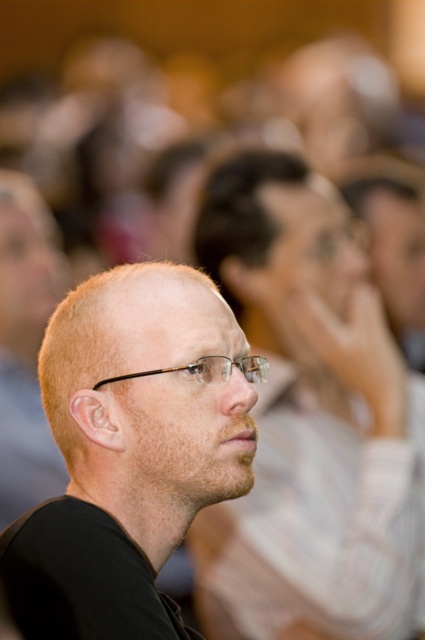
The image size is (425, 640). What are the coordinates of `matte black glasses at center` in the screenshot? It's located at (311, 422).

Describe the element at coordinates (311, 422) in the screenshot. The height and width of the screenshot is (640, 425). I see `matte black glasses at center` at that location.

Which is behind, point (379, 554) or point (62, 563)?

The point (379, 554) is more distant.

At what (x,y) coordinates should I click in order to perform the action: click on matte black glasses at center. Please return your answer as a coordinate pair (x, y). Image resolution: width=425 pixels, height=640 pixels. Looking at the image, I should click on (311, 422).

Based on the photo, does matte black glasses at center have a greater width compared to clear plastic glasses at center?

Yes.

Is matte black glasses at center to the right of clear plastic glasses at center from the viewer's perspective?

Correct, you'll find matte black glasses at center to the right of clear plastic glasses at center.

What are the coordinates of `matte black glasses at center` in the screenshot? It's located at (311, 422).

Identify the location of matte black glasses at center. The image size is (425, 640). pyautogui.click(x=311, y=422).

Does matte black shirt at center have a larger size compared to clear plastic glasses at center?

Yes, matte black shirt at center is bigger than clear plastic glasses at center.

Describe the element at coordinates (130, 451) in the screenshot. The height and width of the screenshot is (640, 425). I see `matte black shirt at center` at that location.

Does point (169, 355) come closer to viewer compared to point (113, 376)?

No, (169, 355) is further to viewer.

The width and height of the screenshot is (425, 640). Find the location of `matte black shirt at center`. matte black shirt at center is located at coordinates (130, 451).